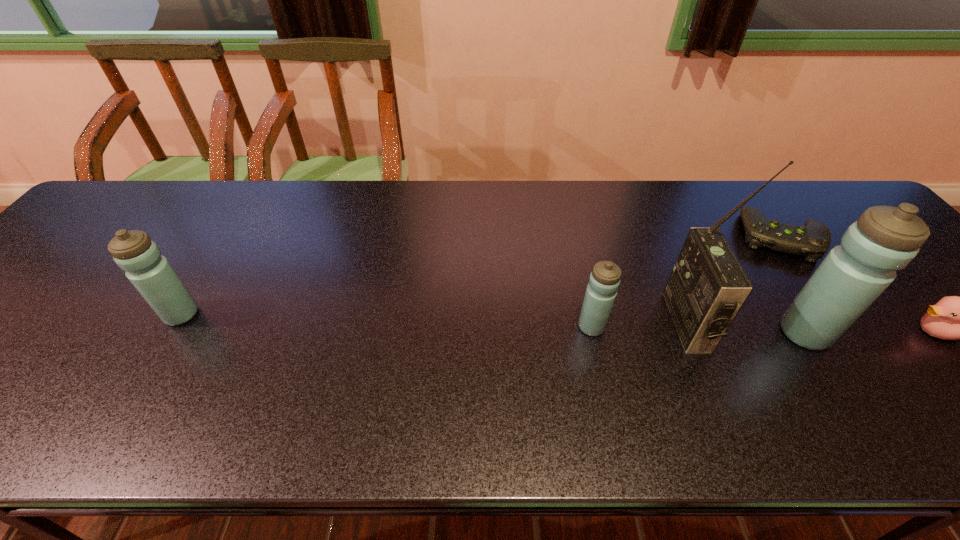
At what (x,y) coordinates should I click in order to perform the action: click on vacant spot for a new water_bottle to ensure equal spacing. Please return your answer as a coordinate pair (x, y). This screenshot has height=540, width=960. Looking at the image, I should click on (384, 321).